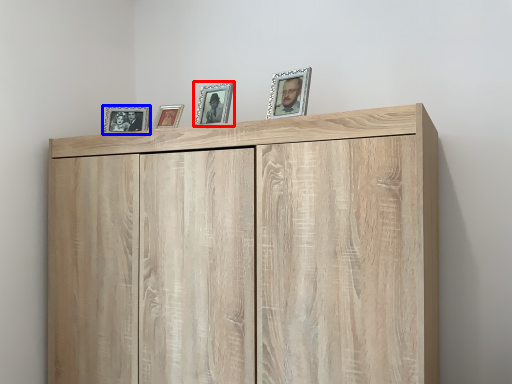
Question: Among these objects, which one is nearest to the camera, picture frame (highlighted by a red box) or picture frame (highlighted by a blue box)?

Choices:
 (A) picture frame
 (B) picture frame

Answer: (A)